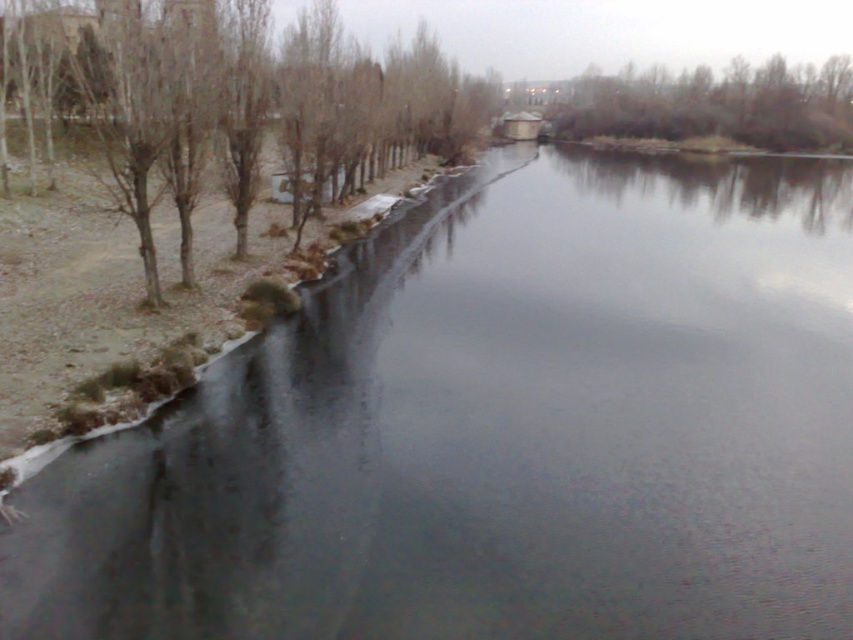
Question: Does bare branches at left come in front of brown textured tree at upper right?

Choices:
 (A) yes
 (B) no

Answer: (A)

Question: Among these objects, which one is farthest from the camera?

Choices:
 (A) brown textured tree at upper right
 (B) bare branches at left

Answer: (A)

Question: Among these objects, which one is nearest to the camera?

Choices:
 (A) bare branches at left
 (B) brown textured tree at upper right

Answer: (A)

Question: From the image, what is the correct spatial relationship of bare branches at left in relation to brown textured tree at upper right?

Choices:
 (A) right
 (B) left

Answer: (B)

Question: Which of the following is the closest to the observer?

Choices:
 (A) (798, 113)
 (B) (154, 253)

Answer: (B)

Question: Where is bare branches at left located in relation to brown textured tree at upper right in the image?

Choices:
 (A) left
 (B) right

Answer: (A)